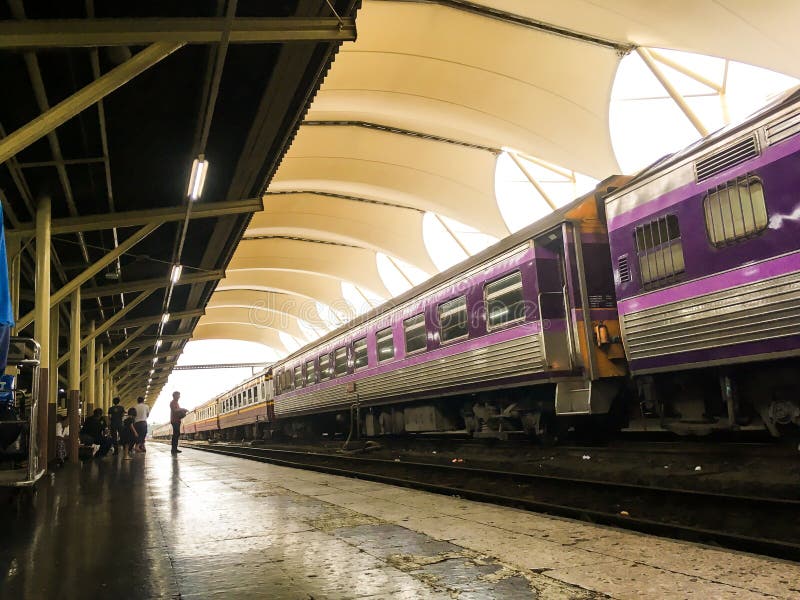
This screenshot has height=600, width=800. What are the coordinates of `vents` in the screenshot? It's located at (722, 164).